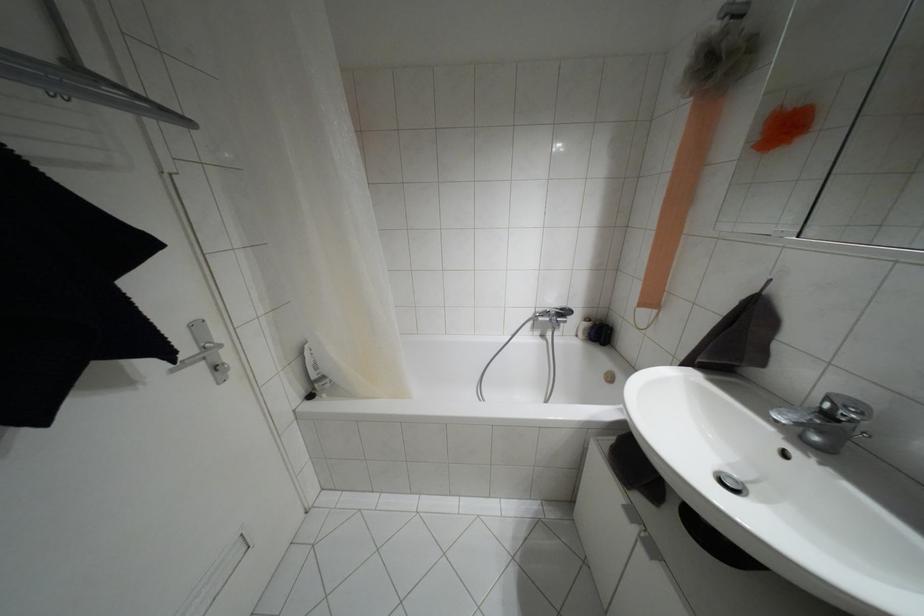
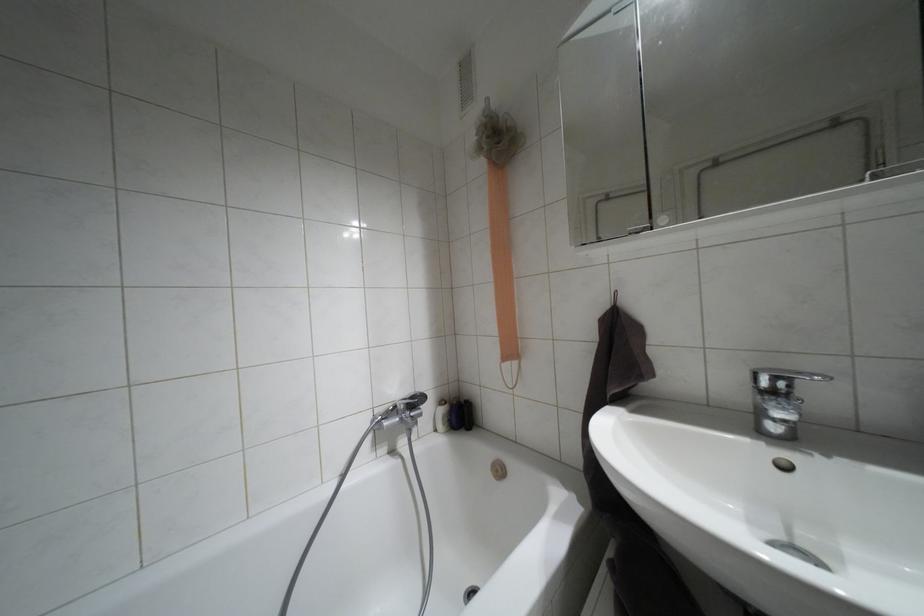
How did the camera likely rotate?

The camera's rotation is toward right-up.